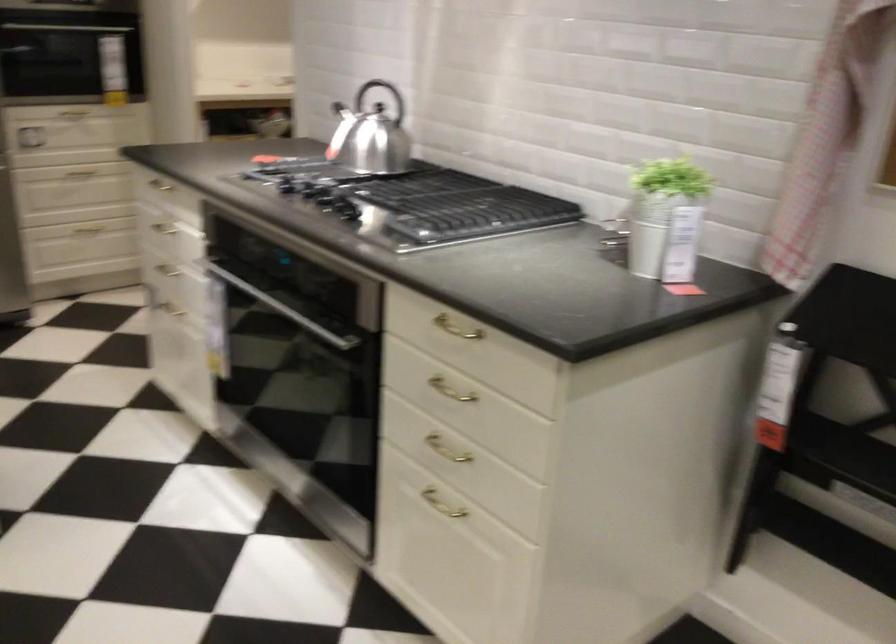
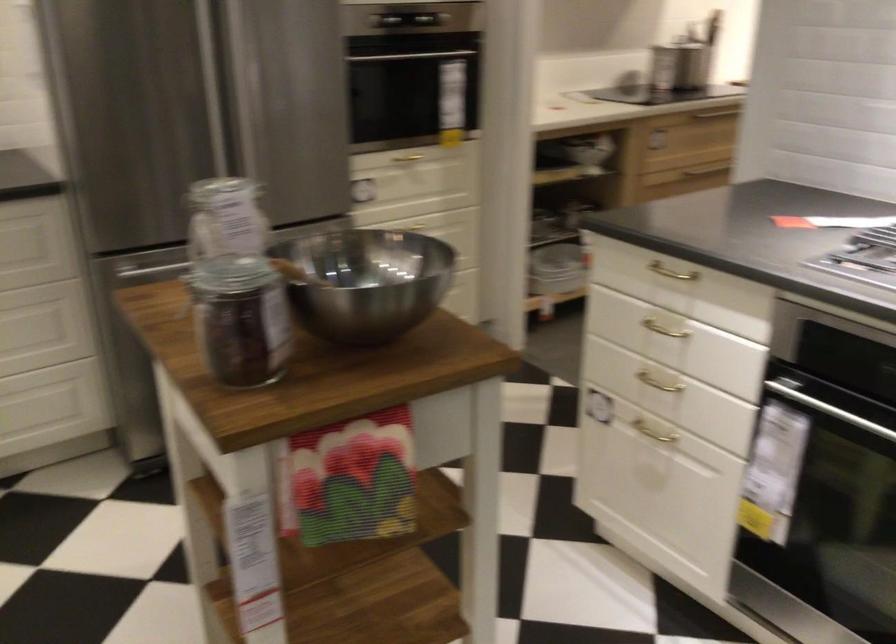
The point at (x=174, y=228) is marked in the first image. Where is the corresponding point in the second image?

(664, 328)